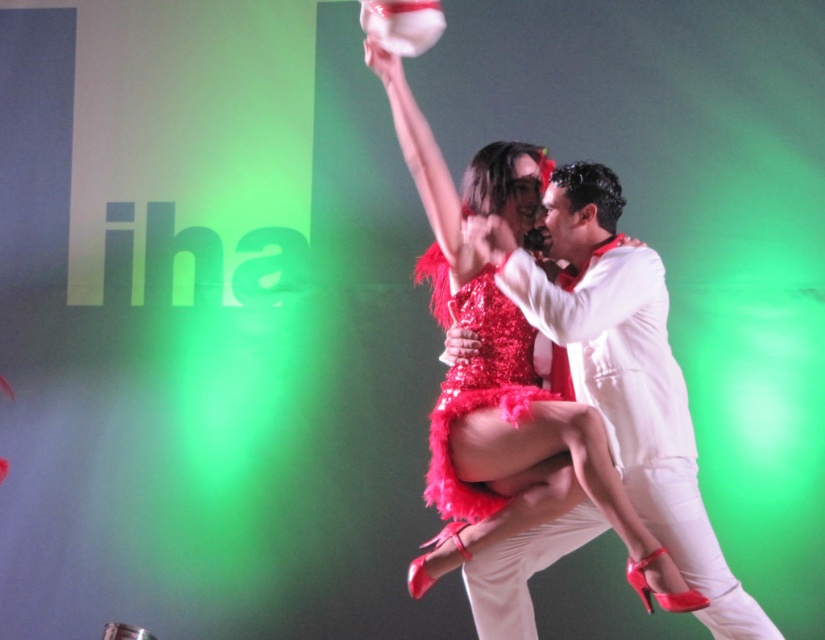
You are a photographer capturing the scene of two performers on stage. You notice the white satin suit at center and the shiny sequined dress at center. Which one is located to the right of the other?

The white satin suit at center is positioned on the right side of the shiny sequined dress at center.

You are a stagehand who needs to place a new spotlight exactly where the white satin suit at center is located. According to the coordinates provided, where should you aim the spotlight?

The white satin suit at center is located at coordinates point (x=621, y=371), so you should aim the spotlight at that exact point.